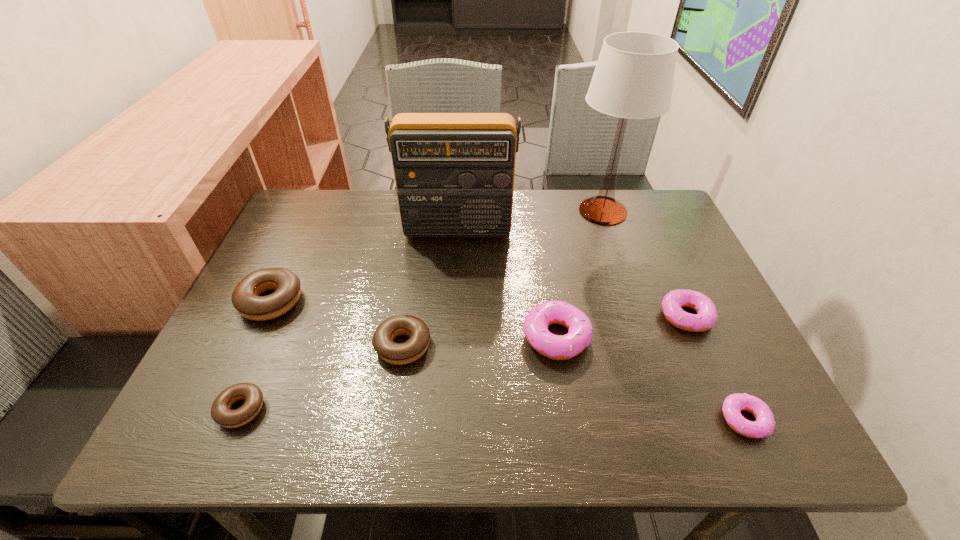
Identify the location of vacant point located between the second biggest pink doughnut and the second tallest object. This screenshot has width=960, height=540. (572, 273).

Locate an element on the screen. This screenshot has width=960, height=540. vacant area between the smallest pink doughnut and the radio receiver is located at coordinates (601, 325).

This screenshot has width=960, height=540. I want to click on vacant area that lies between the nearest brown doughnut and the second smallest pink doughnut, so click(x=464, y=363).

This screenshot has width=960, height=540. In order to click on empty location between the second biggest pink doughnut and the fourth doughnut from left to right in this screenshot , I will do `click(621, 327)`.

Find the location of a particular element. The height and width of the screenshot is (540, 960). object that stands as the second closest to the table lamp is located at coordinates (706, 316).

Where is `the third closest object to the table lamp`? Image resolution: width=960 pixels, height=540 pixels. the third closest object to the table lamp is located at coordinates (557, 347).

You are a GUI agent. You are given a task and a screenshot of the screen. Output one action in this format:
    pyautogui.click(x=<x>, y=<y>)
    Task: Click on the closest doughnut relative to the smallest brown doughnut
    The image size is (960, 540).
    Given the screenshot: What is the action you would take?
    pyautogui.click(x=246, y=299)

This screenshot has height=540, width=960. What are the coordinates of `doughnut that is the closest one to the smallest brown doughnut` in the screenshot? It's located at (246, 299).

Locate which brown doughnut is the second closest to the second smallest brown doughnut. Please provide its 2D coordinates. Your answer should be formatted as a tuple, i.e. [(x, y)], where the tuple contains the x and y coordinates of a point satisfying the conditions above.

[(246, 299)]

The width and height of the screenshot is (960, 540). Identify the location of brown doughnut object that ranks as the closest to the radio receiver. (246, 299).